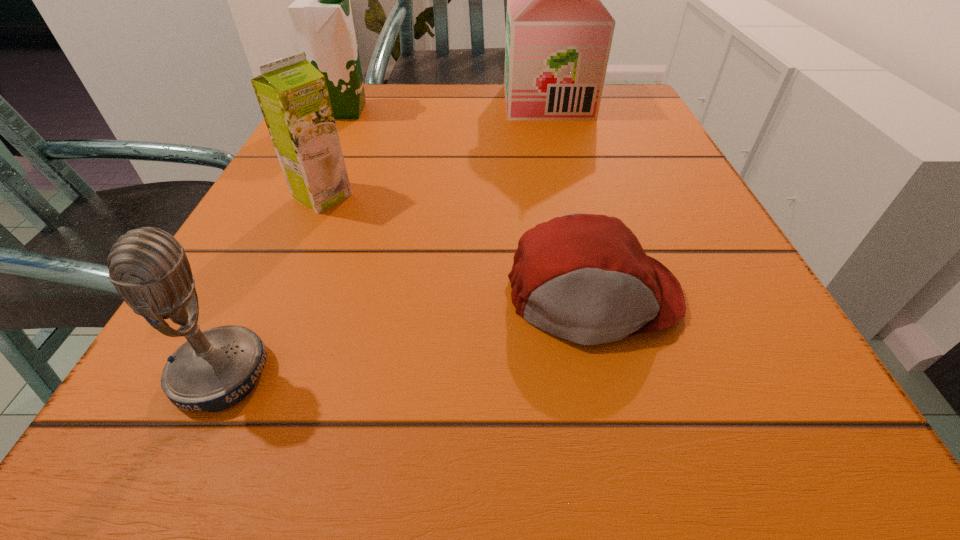
Identify the location of vacant space at the left edge of the desktop. (351, 136).

Locate an element on the screen. This screenshot has height=540, width=960. blank space at the right edge of the desktop is located at coordinates (636, 147).

In the image, there is a desktop. Find the location of `vacant region at the near left corner`. vacant region at the near left corner is located at coordinates (238, 472).

Locate an element on the screen. vacant space at the far right corner of the desktop is located at coordinates (579, 131).

Identify the location of vacant space at the near right corner. (745, 441).

The height and width of the screenshot is (540, 960). I want to click on free space between the tallest object and the cap, so click(570, 199).

Where is `vacant region between the third farthest object and the rightmost soya milk`? This screenshot has width=960, height=540. vacant region between the third farthest object and the rightmost soya milk is located at coordinates (435, 148).

Image resolution: width=960 pixels, height=540 pixels. I want to click on empty space that is in between the cap and the third nearest object, so click(x=458, y=247).

Identify the location of blank region between the third farthest object and the tallest soya milk. This screenshot has width=960, height=540. (435, 148).

You are a GUI agent. You are given a task and a screenshot of the screen. Output one action in this format:
    pyautogui.click(x=<x>, y=<y>)
    Task: Click on the vacant area that lies between the microphone and the nearest soya milk
    The image size is (960, 540).
    Given the screenshot: What is the action you would take?
    pyautogui.click(x=272, y=285)